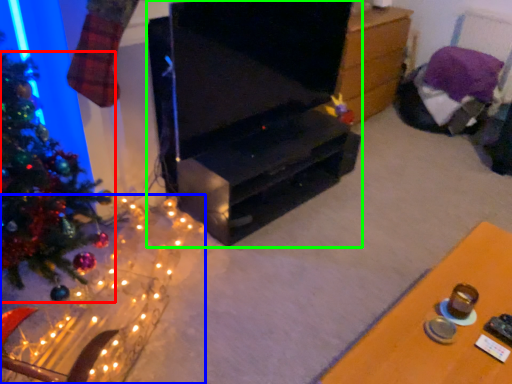
Question: Which is nearer to the christmas tree (highlighted by a red box)? christmas decoration (highlighted by a blue box) or furniture (highlighted by a green box).

Choices:
 (A) christmas decoration
 (B) furniture

Answer: (A)